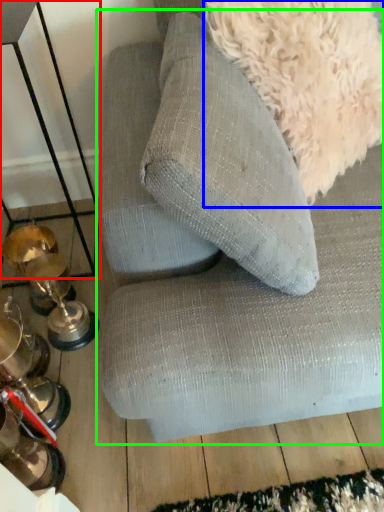
Question: Which object is the farthest from table (highlighted by a red box)? Choose among these: dog (highlighted by a blue box) or studio couch (highlighted by a green box).

Choices:
 (A) dog
 (B) studio couch

Answer: (A)